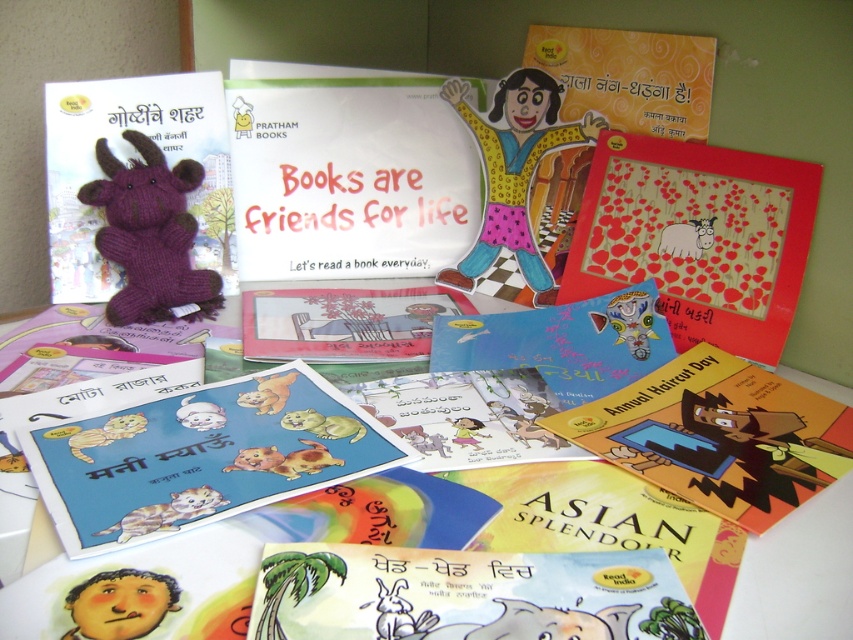
Question: Is matte red frame at upper right wider than matte pink book at center?

Choices:
 (A) no
 (B) yes

Answer: (A)

Question: Which point appears farthest from the camera in this image?

Choices:
 (A) (407, 307)
 (B) (277, 392)
 (C) (573, 424)

Answer: (A)

Question: Which point is closer to the camera taking this photo?

Choices:
 (A) (126, 605)
 (B) (326, 342)
 (C) (180, 419)
 (D) (45, 488)

Answer: (A)

Question: Which point appears closest to the camera in this image?

Choices:
 (A) (331, 422)
 (B) (262, 344)

Answer: (A)

Question: Is fluffy purple stuffed cat at center to the right of white paper sheep at center from the viewer's perspective?

Choices:
 (A) yes
 (B) no

Answer: (B)

Question: Does fluffy brown cat at center appear under white plush cat at center?

Choices:
 (A) yes
 (B) no

Answer: (B)